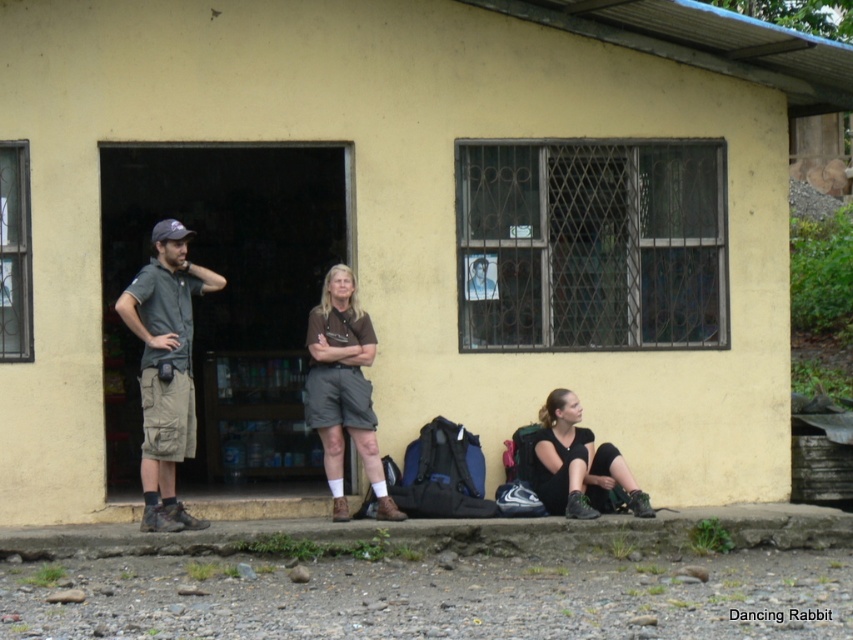
Can you confirm if brown matte shorts at center is positioned to the right of black matte leggings at lower right?

Incorrect, brown matte shorts at center is not on the right side of black matte leggings at lower right.

You are a GUI agent. You are given a task and a screenshot of the screen. Output one action in this format:
    pyautogui.click(x=<x>, y=<y>)
    Task: Click on the brown matte shorts at center
    The image size is (853, 640).
    Given the screenshot: What is the action you would take?
    pyautogui.click(x=343, y=388)

Between point (367, 404) and point (543, 449), which one is positioned behind?

The point (543, 449) is more distant.

Identify the location of brown matte shorts at center. (343, 388).

Is point (172, 506) positioned in front of point (573, 477)?

Yes, point (172, 506) is closer to viewer.

Does dark gray fabric shirt at left have a greater height compared to black matte leggings at lower right?

Yes, dark gray fabric shirt at left is taller than black matte leggings at lower right.

At what (x,y) coordinates should I click in order to perform the action: click on dark gray fabric shirt at left. Please return your answer as a coordinate pair (x, y). The height and width of the screenshot is (640, 853). Looking at the image, I should click on point(165,369).

Who is positioned more to the right, khaki cargo shorts at center or brown matte shorts at center?

brown matte shorts at center

Can you confirm if khaki cargo shorts at center is positioned below brown matte shorts at center?

No, khaki cargo shorts at center is not below brown matte shorts at center.

Looking at this image, who is more distant from viewer, (x=334, y=518) or (x=329, y=310)?

Point (x=329, y=310)

This screenshot has height=640, width=853. What are the coordinates of `khaki cargo shorts at center` in the screenshot? It's located at (166, 368).